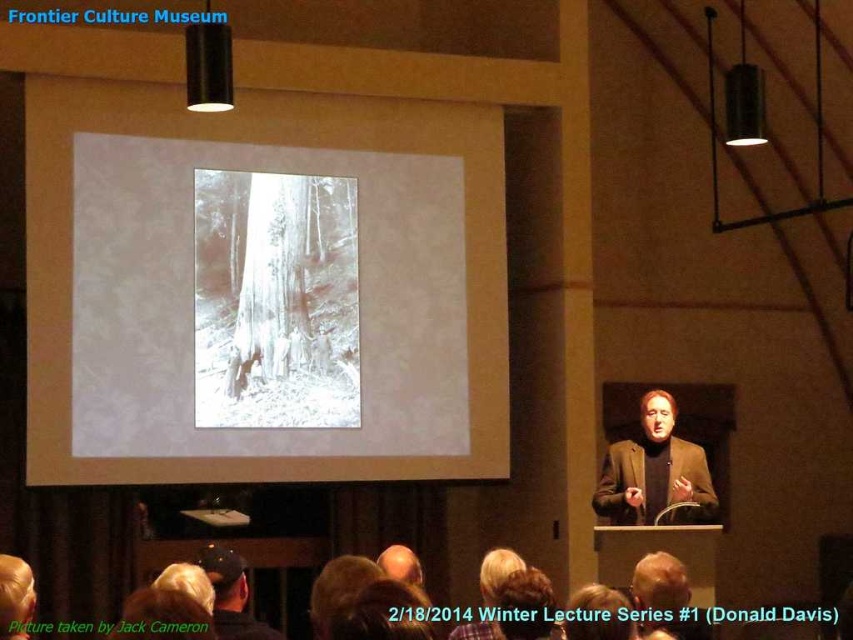
You are an attendee at the lecture and you want to take a photo of the white paper at center and the brown woolen sweater at center. Which object should you zoom in on to ensure both are in focus without moving your camera?

The white paper at center is bigger than the brown woolen sweater at center, so you should zoom in on the white paper at center to ensure both are in focus without moving your camera.